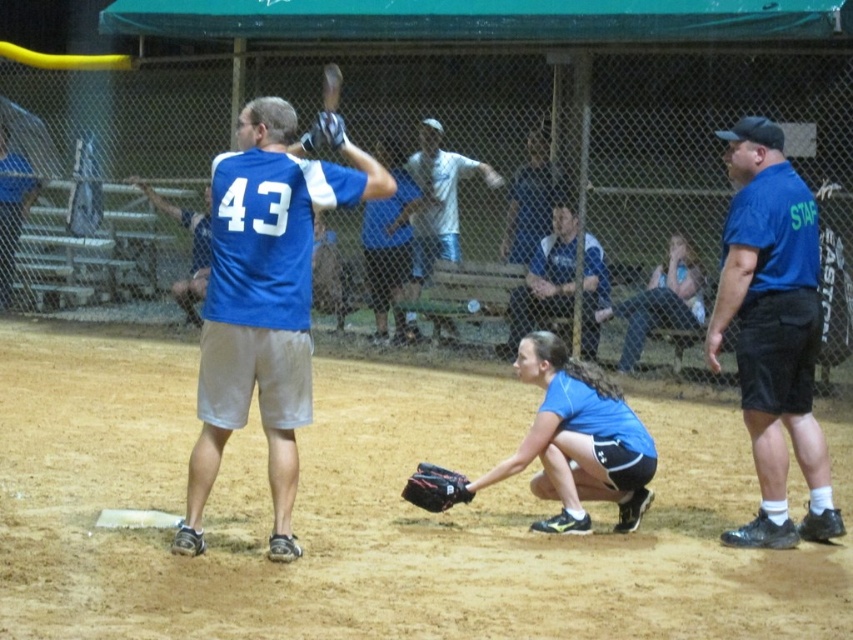
Can you confirm if blue fabric shirt at right is positioned below blue jersey at center?

Yes, blue fabric shirt at right is below blue jersey at center.

Is blue fabric shirt at right positioned before blue jersey at center?

Yes, blue fabric shirt at right is closer to the viewer.

Where is `blue fabric shirt at right`? blue fabric shirt at right is located at coordinates (773, 330).

Can you confirm if blue fabric shirt at center is positioned above blue fabric shirt at right?

No, blue fabric shirt at center is not above blue fabric shirt at right.

Does point (306, 193) come behind point (811, 461)?

No, (306, 193) is in front of (811, 461).

Between point (225, 392) and point (747, 390), which one is positioned in front?

Point (225, 392) is more forward.

Find the location of `blue fabric shirt at center`. blue fabric shirt at center is located at coordinates (265, 298).

Who is more distant from viewer, (280, 541) or (589, 257)?

Positioned behind is point (589, 257).

Which is below, blue fabric shirt at center or blue jersey at center?

blue fabric shirt at center

Is point (234, 264) positioned in front of point (521, 305)?

Yes.

The width and height of the screenshot is (853, 640). Identify the location of blue fabric shirt at center. (265, 298).